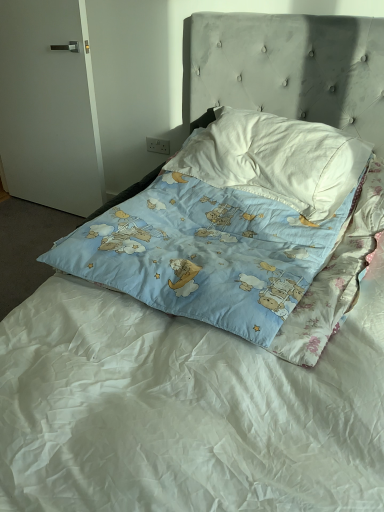
At what (x,y) coordinates should I click in order to perform the action: click on blue cotton pillow at center, which ranks as the first pillow in bottom-to-top order. Please return your answer as a coordinate pair (x, y). Looking at the image, I should click on (227, 228).

Describe the element at coordinates (49, 106) in the screenshot. I see `white matte door at left` at that location.

Locate an element on the screen. blue cotton pillow at center, which ranks as the first pillow in bottom-to-top order is located at coordinates (227, 228).

Considering the sizes of white cotton pillow at upper center, positioned as the 2th pillow in bottom-to-top order, and white matte door at left in the image, is white cotton pillow at upper center, positioned as the 2th pillow in bottom-to-top order, taller or shorter than white matte door at left?

Considering their sizes, white cotton pillow at upper center, positioned as the 2th pillow in bottom-to-top order, has less height than white matte door at left.

Based on the photo, from a real-world perspective, is white cotton pillow at upper center, the first pillow when ordered from top to bottom, positioned under white matte door at left based on gravity?

No, from a real-world perspective, white cotton pillow at upper center, the first pillow when ordered from top to bottom, is not beneath white matte door at left.

How many degrees apart are the facing directions of white cotton pillow at upper center, the first pillow when ordered from top to bottom, and white matte door at left?

The facing directions of white cotton pillow at upper center, the first pillow when ordered from top to bottom, and white matte door at left are 5.23 degrees apart.

Is white cotton pillow at upper center, the first pillow when ordered from top to bottom, bigger than white matte door at left?

Yes, white cotton pillow at upper center, the first pillow when ordered from top to bottom, is bigger than white matte door at left.

How different are the orientations of white matte door at left and blue cotton pillow at center, the 2th pillow positioned from the top, in degrees?

The facing directions of white matte door at left and blue cotton pillow at center, the 2th pillow positioned from the top, are 4.08 degrees apart.

Is white matte door at left not close to blue cotton pillow at center, the 2th pillow positioned from the top?

Yes, white matte door at left and blue cotton pillow at center, the 2th pillow positioned from the top, are located far from each other.

Is the position of white matte door at left more distant than that of blue cotton pillow at center, which ranks as the first pillow in bottom-to-top order?

Yes, it is behind blue cotton pillow at center, which ranks as the first pillow in bottom-to-top order.

Is white matte door at left looking in the opposite direction of blue cotton pillow at center, which ranks as the first pillow in bottom-to-top order?

No, white matte door at left's orientation is not away from blue cotton pillow at center, which ranks as the first pillow in bottom-to-top order.

Can you confirm if blue cotton pillow at center, the 2th pillow positioned from the top, is smaller than white cotton pillow at upper center, the first pillow when ordered from top to bottom?

Actually, blue cotton pillow at center, the 2th pillow positioned from the top, might be larger than white cotton pillow at upper center, the first pillow when ordered from top to bottom.

Considering the sizes of objects blue cotton pillow at center, the 2th pillow positioned from the top, and white cotton pillow at upper center, the first pillow when ordered from top to bottom, in the image provided, who is wider, blue cotton pillow at center, the 2th pillow positioned from the top, or white cotton pillow at upper center, the first pillow when ordered from top to bottom,?

blue cotton pillow at center, the 2th pillow positioned from the top.

The height and width of the screenshot is (512, 384). I want to click on pillow lying above the blue cotton pillow at center, the 2th pillow positioned from the top (from the image's perspective), so click(275, 160).

From the image's perspective, is blue cotton pillow at center, which ranks as the first pillow in bottom-to-top order, positioned above or below white cotton pillow at upper center, positioned as the 2th pillow in bottom-to-top order?

From the image's perspective, blue cotton pillow at center, which ranks as the first pillow in bottom-to-top order, appears below white cotton pillow at upper center, positioned as the 2th pillow in bottom-to-top order.

Which pillow is the 2nd one when counting from the front of the white matte door at left? Please provide its 2D coordinates.

[(227, 228)]

Who is taller, blue cotton pillow at center, which ranks as the first pillow in bottom-to-top order, or white matte door at left?

white matte door at left is taller.

Which is closer to the camera, [314,251] or [66,69]?

Positioned in front is point [314,251].

Which is nearer, (333, 205) or (275, 129)?

Point (333, 205) is closer to the camera than point (275, 129).

Is white cotton pillow at upper center, positioned as the 2th pillow in bottom-to-top order, far away from blue cotton pillow at center, the 2th pillow positioned from the top?

No.

Consider the image. From a real-world perspective, is white cotton pillow at upper center, the first pillow when ordered from top to bottom, positioned over blue cotton pillow at center, which ranks as the first pillow in bottom-to-top order, based on gravity?

Yes.

Is white cotton pillow at upper center, the first pillow when ordered from top to bottom, bigger or smaller than blue cotton pillow at center, which ranks as the first pillow in bottom-to-top order?

Clearly, white cotton pillow at upper center, the first pillow when ordered from top to bottom, is smaller in size than blue cotton pillow at center, which ranks as the first pillow in bottom-to-top order.

Does point (54, 90) come in front of point (235, 183)?

That is False.

From a real-world perspective, does white matte door at left stand above white cotton pillow at upper center, positioned as the 2th pillow in bottom-to-top order?

Incorrect, from a real-world perspective, white matte door at left is lower than white cotton pillow at upper center, positioned as the 2th pillow in bottom-to-top order.

Would you say white matte door at left is a long distance from white cotton pillow at upper center, positioned as the 2th pillow in bottom-to-top order?

white matte door at left is positioned a significant distance from white cotton pillow at upper center, positioned as the 2th pillow in bottom-to-top order.

Based on their positions, is white matte door at left located to the left or right of white cotton pillow at upper center, positioned as the 2th pillow in bottom-to-top order?

From the image, it's evident that white matte door at left is to the left of white cotton pillow at upper center, positioned as the 2th pillow in bottom-to-top order.

At what (x,y) coordinates should I click in order to perform the action: click on door below the white cotton pillow at upper center, positioned as the 2th pillow in bottom-to-top order (from a real-world perspective). Please return your answer as a coordinate pair (x, y). Image resolution: width=384 pixels, height=512 pixels. Looking at the image, I should click on (49, 106).

At what (x,y) coordinates should I click in order to perform the action: click on the 2nd pillow in front of the white matte door at left, starting your count from the anchor. Please return your answer as a coordinate pair (x, y). The width and height of the screenshot is (384, 512). Looking at the image, I should click on (227, 228).

Based on their spatial positions, is blue cotton pillow at center, the 2th pillow positioned from the top, or white cotton pillow at upper center, positioned as the 2th pillow in bottom-to-top order, further from white matte door at left?

blue cotton pillow at center, the 2th pillow positioned from the top, is further to white matte door at left.

Looking at the image, which one is located closer to white cotton pillow at upper center, the first pillow when ordered from top to bottom, white matte door at left or blue cotton pillow at center, the 2th pillow positioned from the top?

Among the two, blue cotton pillow at center, the 2th pillow positioned from the top, is located nearer to white cotton pillow at upper center, the first pillow when ordered from top to bottom.

Estimate the real-world distances between objects in this image. Which object is further from blue cotton pillow at center, the 2th pillow positioned from the top, white cotton pillow at upper center, the first pillow when ordered from top to bottom, or white matte door at left?

white matte door at left is positioned further to the anchor blue cotton pillow at center, the 2th pillow positioned from the top.

Which object lies further to the anchor point white cotton pillow at upper center, positioned as the 2th pillow in bottom-to-top order, blue cotton pillow at center, which ranks as the first pillow in bottom-to-top order, or white matte door at left?

white matte door at left lies further to white cotton pillow at upper center, positioned as the 2th pillow in bottom-to-top order, than the other object.

When comparing their distances from blue cotton pillow at center, the 2th pillow positioned from the top, does white matte door at left or white cotton pillow at upper center, positioned as the 2th pillow in bottom-to-top order, seem closer?

Among the two, white cotton pillow at upper center, positioned as the 2th pillow in bottom-to-top order, is located nearer to blue cotton pillow at center, the 2th pillow positioned from the top.

When comparing their distances from white matte door at left, does white cotton pillow at upper center, the first pillow when ordered from top to bottom, or blue cotton pillow at center, which ranks as the first pillow in bottom-to-top order, seem further?

The object further to white matte door at left is blue cotton pillow at center, which ranks as the first pillow in bottom-to-top order.

The width and height of the screenshot is (384, 512). Find the location of `pillow between white matte door at left and white cotton pillow at upper center, positioned as the 2th pillow in bottom-to-top order`. pillow between white matte door at left and white cotton pillow at upper center, positioned as the 2th pillow in bottom-to-top order is located at coordinates (227, 228).